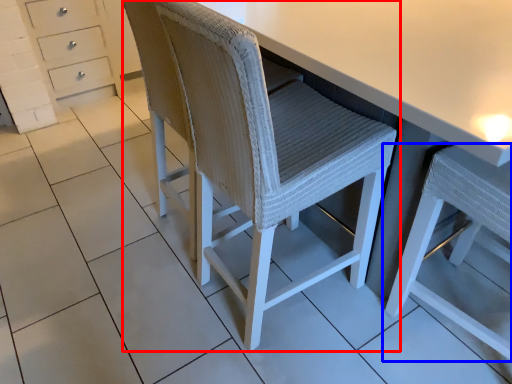
Question: Which point is further to the camera, chair (highlighted by a red box) or chair (highlighted by a blue box)?

Choices:
 (A) chair
 (B) chair

Answer: (A)